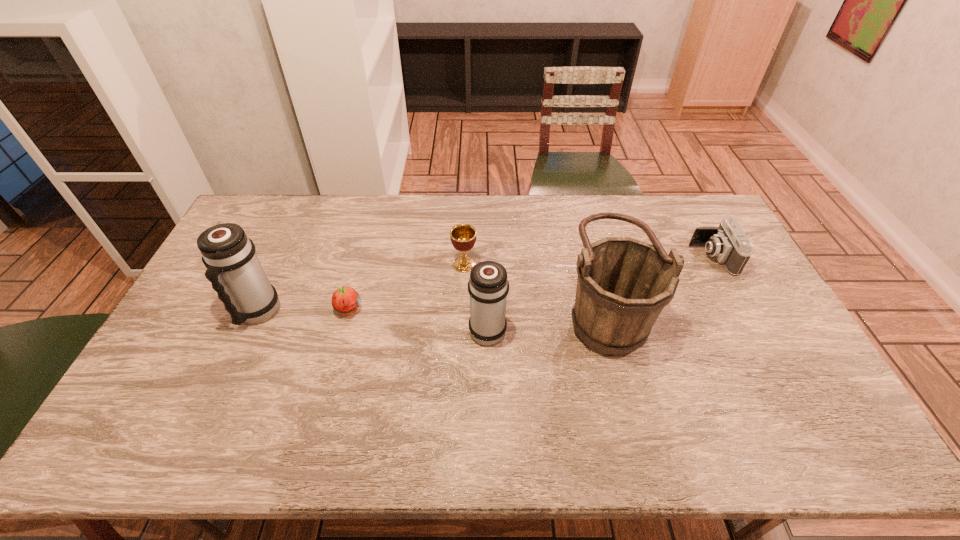
Identify the location of vacant space located on the right of the chalice. pyautogui.click(x=540, y=264).

Where is `object that is at the left edge`? This screenshot has height=540, width=960. object that is at the left edge is located at coordinates (233, 268).

Identify the location of object that is at the right edge. (728, 243).

Locate an element on the screen. The height and width of the screenshot is (540, 960). vacant region at the far edge is located at coordinates (319, 235).

The height and width of the screenshot is (540, 960). I want to click on blank space at the right edge, so click(702, 251).

In the image, there is a desktop. In order to click on free space at the near left corner in this screenshot , I will do `click(180, 394)`.

At what (x,y) coordinates should I click in order to perform the action: click on free spot between the leftmost object and the fifth object from right to left. Please return your answer as a coordinate pair (x, y). Looking at the image, I should click on (303, 312).

Locate an element on the screen. This screenshot has width=960, height=540. vacant space that is in between the chalice and the second object from left to right is located at coordinates (406, 287).

Find the location of a particular element. free spot between the fifth object from right to left and the camera is located at coordinates click(x=530, y=284).

Where is `vacant area between the right thermos bottle and the shortest object`? vacant area between the right thermos bottle and the shortest object is located at coordinates (418, 320).